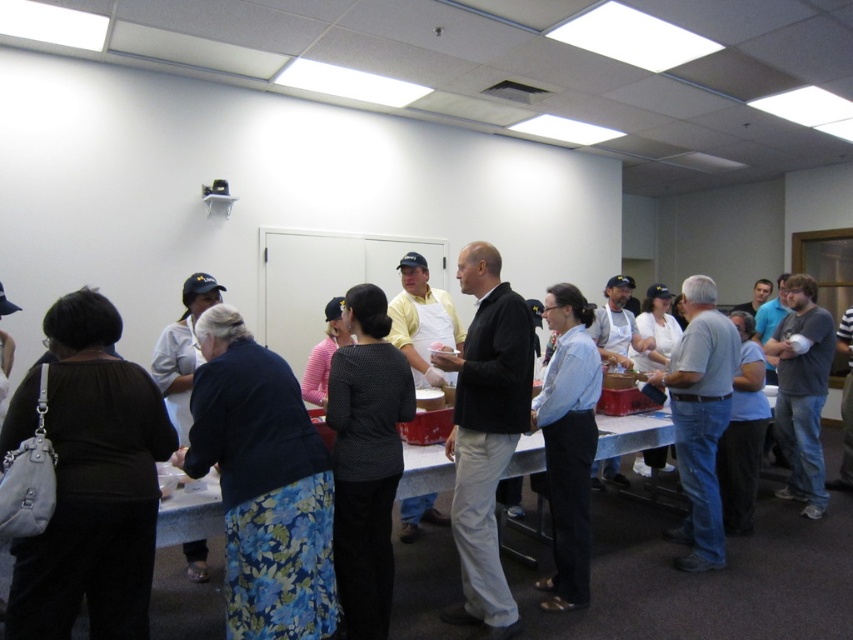
Question: Which point is farther to the camera?

Choices:
 (A) light gray shirt at center
 (B) blue floral skirt at lower left
 (C) white matte uniform at left
 (D) black shirt at center

Answer: (A)

Question: Is black shirt at center smaller than black matte jacket at center?

Choices:
 (A) yes
 (B) no

Answer: (B)

Question: Which of the following is the farthest from the observer?

Choices:
 (A) white matte uniform at left
 (B) gray matte shirt at right

Answer: (B)

Question: Is light blue shirt at center thinner than white matte uniform at left?

Choices:
 (A) no
 (B) yes

Answer: (A)

Question: Considering the real-world distances, which object is farthest from the black shirt at center?

Choices:
 (A) light blue shirt at center
 (B) black matte jacket at center
 (C) black matte shirt at left
 (D) blue floral skirt at lower left

Answer: (C)

Question: Can you confirm if black shirt at center is positioned above gray matte shirt at right?

Choices:
 (A) yes
 (B) no

Answer: (B)